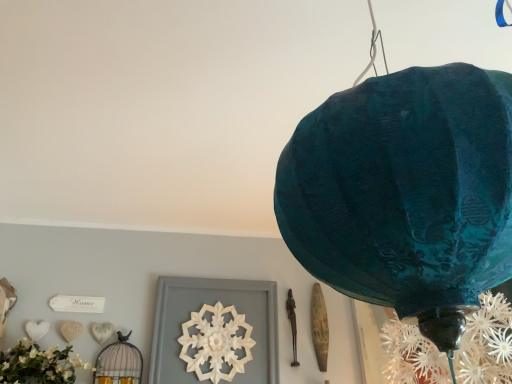
Find the location of a particular element. matte black birdcage at lower left is located at coordinates (119, 363).

Identify the location of teal paper lantern at upper right. The height and width of the screenshot is (384, 512). [405, 193].

Locate an element on the screen. matte black birdcage at lower left is located at coordinates (119, 363).

The image size is (512, 384). I want to click on lantern in front of the matte black birdcage at lower left, so click(x=405, y=193).

From the image's perspective, which one is positioned lower, teal paper lantern at upper right or matte black birdcage at lower left?

matte black birdcage at lower left, from the image's perspective.

Considering the relative sizes of teal paper lantern at upper right and matte black birdcage at lower left in the image provided, is teal paper lantern at upper right shorter than matte black birdcage at lower left?

No, teal paper lantern at upper right is not shorter than matte black birdcage at lower left.

Is point (291, 148) less distant than point (103, 358)?

Yes, point (291, 148) is in front of point (103, 358).

The width and height of the screenshot is (512, 384). What are the coordinates of `lamp in front of the white carved wood at center` in the screenshot? It's located at click(119, 363).

Does matte black birdcage at lower left have a lesser width compared to white carved wood at center?

Incorrect, the width of matte black birdcage at lower left is not less than that of white carved wood at center.

Is matte black birdcage at lower left spatially inside white carved wood at center, or outside of it?

matte black birdcage at lower left is spatially situated outside white carved wood at center.

Do you think teal paper lantern at upper right is within white carved wood at center, or outside of it?

teal paper lantern at upper right exists outside the volume of white carved wood at center.

Which is more to the left, teal paper lantern at upper right or white carved wood at center?

Positioned to the left is white carved wood at center.

From a real-world perspective, is teal paper lantern at upper right over white carved wood at center?

Correct, in the physical world, teal paper lantern at upper right is higher than white carved wood at center.

Is white carved wood at center taller or shorter than matte black birdcage at lower left?

white carved wood at center is taller than matte black birdcage at lower left.

From a real-world perspective, is white carved wood at center below matte black birdcage at lower left?

No.

Looking at this image, is white carved wood at center looking in the opposite direction of matte black birdcage at lower left?

No, white carved wood at center is not facing away from matte black birdcage at lower left.

What's the angular difference between white carved wood at center and matte black birdcage at lower left's facing directions?

There is a 1.79-degree angle between the facing directions of white carved wood at center and matte black birdcage at lower left.

Between matte black birdcage at lower left and teal paper lantern at upper right, which one has less height?

Standing shorter between the two is matte black birdcage at lower left.

Considering the sizes of matte black birdcage at lower left and teal paper lantern at upper right in the image, is matte black birdcage at lower left wider or thinner than teal paper lantern at upper right?

Considering their sizes, matte black birdcage at lower left looks slimmer than teal paper lantern at upper right.

In the scene shown: Does matte black birdcage at lower left turn towards teal paper lantern at upper right?

Yes, matte black birdcage at lower left is oriented towards teal paper lantern at upper right.

From the image's perspective, between matte black birdcage at lower left and teal paper lantern at upper right, which one is located above?

teal paper lantern at upper right is shown above in the image.

Is white carved wood at center aimed at teal paper lantern at upper right?

Yes, white carved wood at center is aimed at teal paper lantern at upper right.

Do you think white carved wood at center is within teal paper lantern at upper right, or outside of it?

white carved wood at center cannot be found inside teal paper lantern at upper right.

From a real-world perspective, is white carved wood at center physically below teal paper lantern at upper right?

Yes.

Which is more to the right, white carved wood at center or teal paper lantern at upper right?

From the viewer's perspective, teal paper lantern at upper right appears more on the right side.

Where is `lamp that appears on the left of teal paper lantern at upper right`? The height and width of the screenshot is (384, 512). lamp that appears on the left of teal paper lantern at upper right is located at coordinates (119, 363).

In the image, there is a white carved wood at center. Find the location of `lamp below it (from a real-world perspective)`. lamp below it (from a real-world perspective) is located at coordinates (119, 363).

From the image, which object appears to be nearer to white carved wood at center, matte black birdcage at lower left or teal paper lantern at upper right?

The object closer to white carved wood at center is matte black birdcage at lower left.

Considering their positions, is matte black birdcage at lower left positioned closer to teal paper lantern at upper right than white carved wood at center?

white carved wood at center lies closer to teal paper lantern at upper right than the other object.

Looking at the image, which one is located further to matte black birdcage at lower left, white carved wood at center or teal paper lantern at upper right?

teal paper lantern at upper right is further to matte black birdcage at lower left.

Considering their positions, is white carved wood at center positioned further to teal paper lantern at upper right than matte black birdcage at lower left?

matte black birdcage at lower left is positioned further to the anchor teal paper lantern at upper right.

From the image, which object appears to be farther from matte black birdcage at lower left, teal paper lantern at upper right or white carved wood at center?

Based on the image, teal paper lantern at upper right appears to be further to matte black birdcage at lower left.

Estimate the real-world distances between objects in this image. Which object is further from white carved wood at center, teal paper lantern at upper right or matte black birdcage at lower left?

teal paper lantern at upper right is further to white carved wood at center.

Image resolution: width=512 pixels, height=384 pixels. Identify the location of lamp positioned between teal paper lantern at upper right and white carved wood at center from near to far. (119, 363).